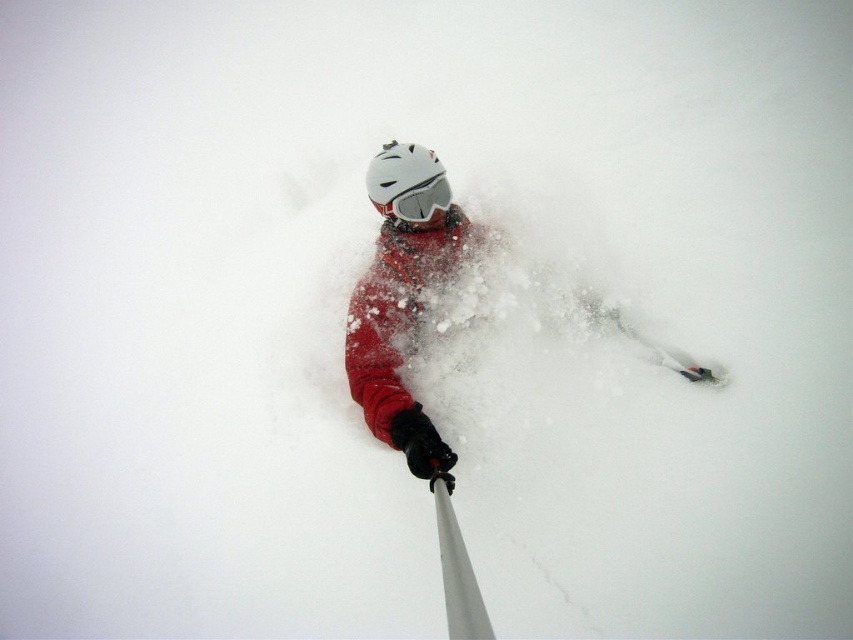
Question: Does white matte helmet at center have a smaller size compared to silver metallic ski pole at lower center?

Choices:
 (A) yes
 (B) no

Answer: (B)

Question: Which of the following is the farthest from the observer?

Choices:
 (A) (396, 186)
 (B) (460, 540)
 (C) (346, 330)

Answer: (C)

Question: Among these points, which one is nearest to the camera?

Choices:
 (A) (409, 204)
 (B) (448, 566)

Answer: (B)

Question: Which point is closer to the camera taking this photo?

Choices:
 (A) (451, 570)
 (B) (421, 168)
 (C) (383, 192)

Answer: (A)

Question: Does matte red snowboarder at center come in front of white matte helmet at center?

Choices:
 (A) no
 (B) yes

Answer: (B)

Question: Does white matte helmet at center have a smaller size compared to silver metallic ski pole at lower center?

Choices:
 (A) yes
 (B) no

Answer: (B)